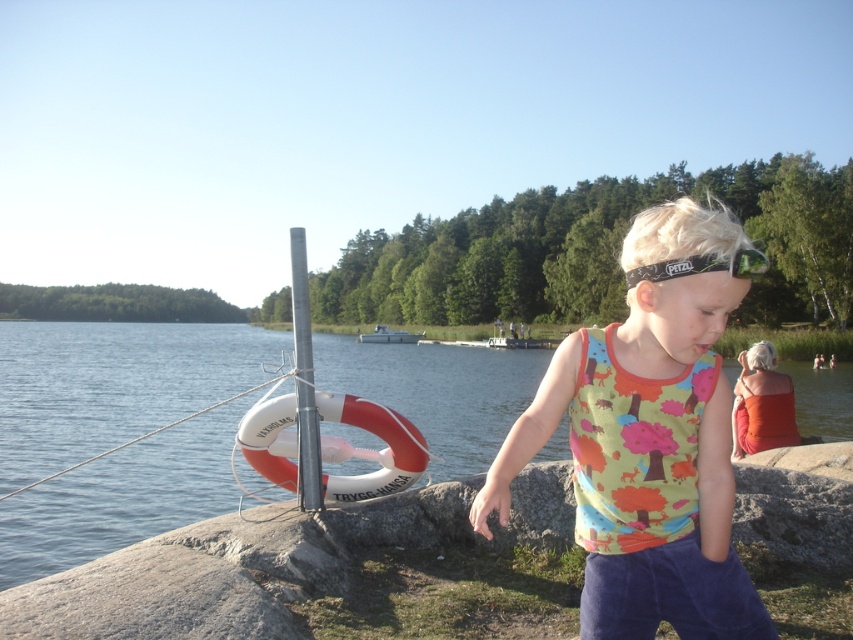
Looking at this image, what is the coordinate of the multicolored fabric tank top at center?

The multicolored fabric tank top at center is located at coordinate point (645, 465).

You are a fashion designer observing the clothing items in the scene. Which clothing item has a narrower width between the multicolored fabric tank top at center and the orange fabric dress at right?

The multicolored fabric tank top at center is thinner than the orange fabric dress at right, so the multicolored fabric tank top at center has a narrower width.